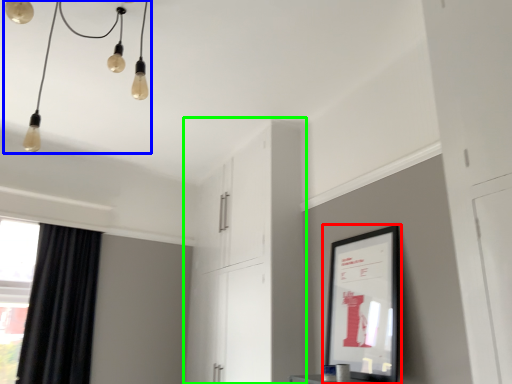
Question: Which object is the closest to the picture frame (highlighted by a red box)? Choose among these: light fixture (highlighted by a blue box) or dresser (highlighted by a green box).

Choices:
 (A) light fixture
 (B) dresser

Answer: (B)